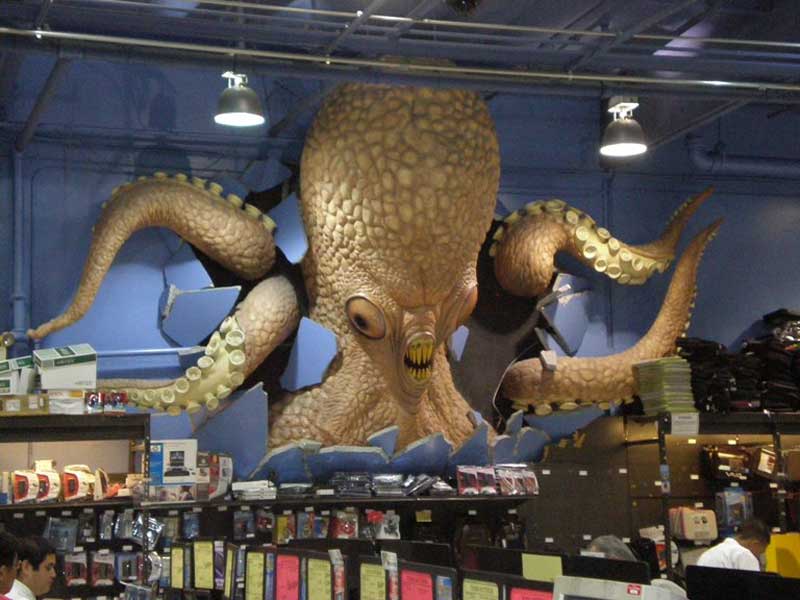
This screenshot has width=800, height=600. I want to click on back wall, so click(57, 231), click(768, 256).